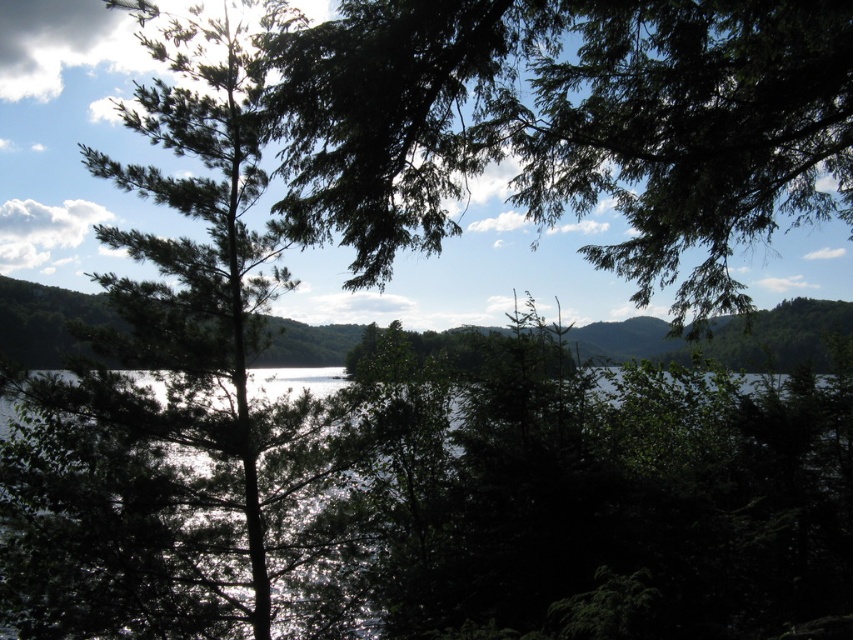
You are standing in the serene landscape and want to take a photo of both the glistening water at center and the green leafy tree at center. Which object should you adjust your camera to focus on first to ensure both are in the frame?

You should focus on the green leafy tree at center first because the glistening water at center is to the right of it, so adjusting the camera to include both would require framing from the tree towards the water.

You are a photographer planning to capture the glistening water at center and the green leafy tree at center in a single frame. Based on their sizes in the image, which object would appear more prominent in your photo?

The green leafy tree at center would appear more prominent in the photo because it is larger than the glistening water at center.